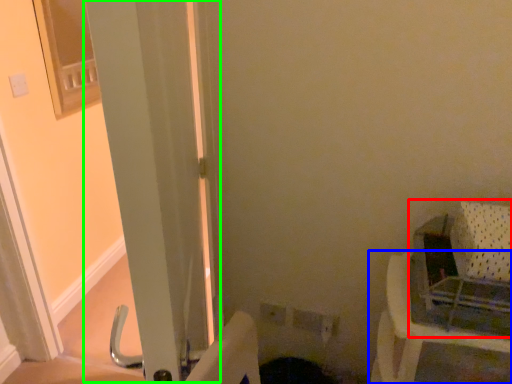
Question: Considering the real-world distances, which object is closest to baby carriage (highlighted by a red box)? furniture (highlighted by a blue box) or screen door (highlighted by a green box).

Choices:
 (A) furniture
 (B) screen door

Answer: (A)